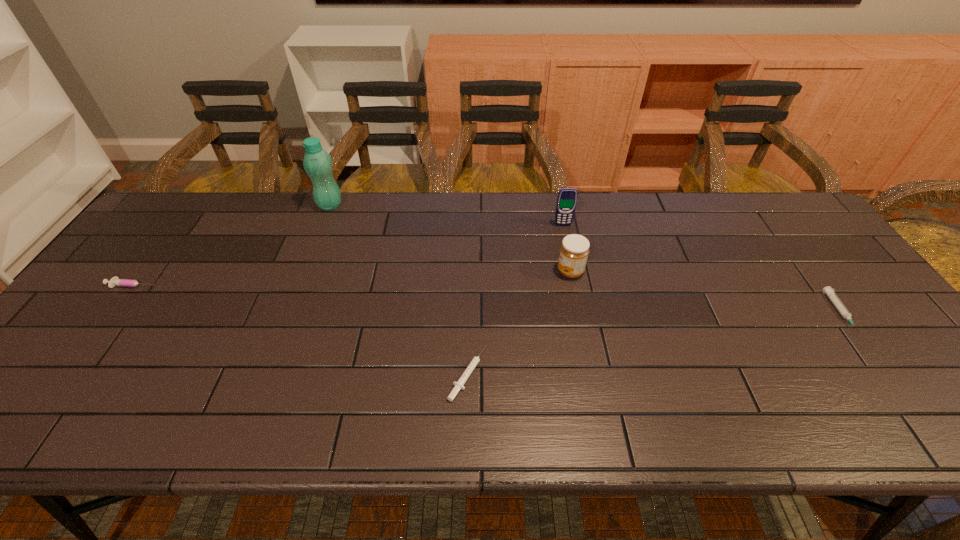
The image size is (960, 540). I want to click on the nearest object, so click(459, 384).

At what (x,y) coordinates should I click in order to perform the action: click on vacant space positioned on the left of the bottle. Please return your answer as a coordinate pair (x, y). The width and height of the screenshot is (960, 540). Looking at the image, I should click on (283, 205).

Identify the location of free spot located on the front-facing side of the fifth shortest object. The image size is (960, 540). (581, 312).

Locate an element on the screen. This screenshot has width=960, height=540. vacant region located 0.280m on the front label of the jam is located at coordinates (456, 272).

The image size is (960, 540). I want to click on vacant space located on the front label of the jam, so click(456, 272).

You are a GUI agent. You are given a task and a screenshot of the screen. Output one action in this format:
    pyautogui.click(x=<x>, y=<y>)
    Task: Click on the free location located on the front label of the jam
    Image resolution: width=960 pixels, height=540 pixels.
    Given the screenshot: What is the action you would take?
    pyautogui.click(x=506, y=272)

This screenshot has height=540, width=960. I want to click on free space located on the right of the leftmost object, so click(181, 285).

Where is `vacant space located 0.140m at the needle end of the second farthest syringe`? This screenshot has width=960, height=540. vacant space located 0.140m at the needle end of the second farthest syringe is located at coordinates (894, 387).

You are a GUI agent. You are given a task and a screenshot of the screen. Output one action in this format:
    pyautogui.click(x=<x>, y=<y>)
    Task: Click on the free spot located on the back of the shortest syringe
    
    Given the screenshot: What is the action you would take?
    pyautogui.click(x=470, y=239)

Image resolution: width=960 pixels, height=540 pixels. What are the coordinates of `bottle that is at the far edge` in the screenshot? It's located at (317, 163).